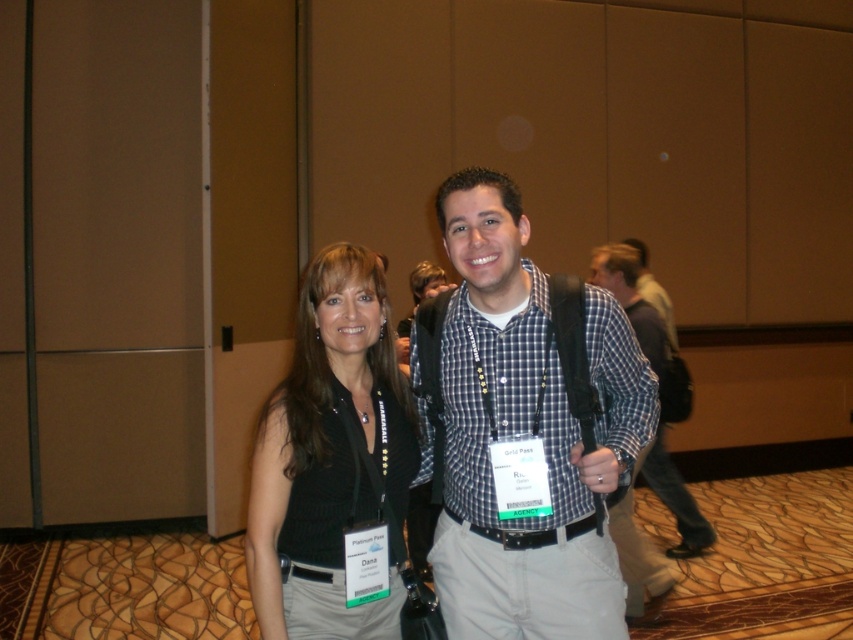
Is point (351, 492) less distant than point (640, 547)?

Yes, it is in front of point (640, 547).

Which of these two, black knitted vest at center or plaid fabric shirt at center, stands taller?

Standing taller between the two is black knitted vest at center.

Where is `black knitted vest at center`? black knitted vest at center is located at coordinates (328, 452).

Where is `black knitted vest at center`? This screenshot has width=853, height=640. black knitted vest at center is located at coordinates (328, 452).

In the scene shown: Does checkered fabric shirt at center have a smaller size compared to black knitted vest at center?

Incorrect, checkered fabric shirt at center is not smaller in size than black knitted vest at center.

Describe the element at coordinates (523, 429) in the screenshot. I see `checkered fabric shirt at center` at that location.

Find the location of a particular element. checkered fabric shirt at center is located at coordinates (523, 429).

Based on the photo, can you confirm if checkered fabric shirt at center is positioned above plaid fabric shirt at center?

No.

Does checkered fabric shirt at center have a larger size compared to plaid fabric shirt at center?

Yes, checkered fabric shirt at center is bigger than plaid fabric shirt at center.

In order to click on checkered fabric shirt at center in this screenshot , I will do `click(523, 429)`.